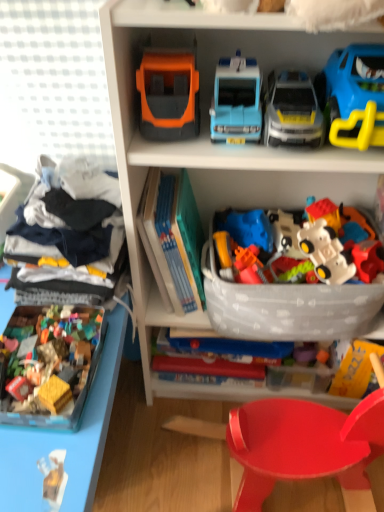
Where is `orange matte truck at upper center, placed as the second toy when sorted from left to right`? orange matte truck at upper center, placed as the second toy when sorted from left to right is located at coordinates (169, 95).

In order to face matte blue plastic car at center, which is counted as the 4th toy, starting from the left, should I rotate leftwards or rightwards?

Turn right approximately 12.968 degrees to face it.

The image size is (384, 512). What do you see at coordinates (292, 111) in the screenshot?
I see `matte blue plastic car at center, placed as the third toy when sorted from right to left` at bounding box center [292, 111].

The width and height of the screenshot is (384, 512). Describe the element at coordinates (297, 246) in the screenshot. I see `white plastic toy car at center, which ranks as the 5th toy in left-to-right order` at that location.

Identify the location of hardcover book at center. This screenshot has height=512, width=384. (175, 237).

What is the approximate height of hardcover book at center?

It is 11.91 inches.

Measure the distance between plastic toy blocks at lower left and camera.

plastic toy blocks at lower left and camera are 25.12 inches apart from each other.

The image size is (384, 512). What do you see at coordinates (65, 439) in the screenshot?
I see `plastic toy blocks at lower left` at bounding box center [65, 439].

Identify the location of blue plastic car at upper right, the first toy when ordered from right to left. (354, 95).

Describe the element at coordinates (354, 95) in the screenshot. I see `blue plastic car at upper right, arranged as the 6th toy when viewed from the left` at that location.

Image resolution: width=384 pixels, height=512 pixels. I want to click on orange matte truck at upper center, placed as the second toy when sorted from left to right, so click(x=169, y=95).

Which of these two, plastic toy blocks at lower left or white plastic toy car at center, the 2th toy viewed from the right, is thinner?

With smaller width is white plastic toy car at center, the 2th toy viewed from the right.

Which is more to the left, plastic toy blocks at lower left or white plastic toy car at center, the 2th toy viewed from the right?

plastic toy blocks at lower left.

The width and height of the screenshot is (384, 512). I want to click on the 2nd toy above the plastic toy blocks at lower left (from the image's perspective), so click(297, 246).

Looking at this image, would you say plastic toy blocks at lower left is outside white plastic toy car at center, the 2th toy viewed from the right?

Yes, plastic toy blocks at lower left is located beyond the bounds of white plastic toy car at center, the 2th toy viewed from the right.

Which of these two, plastic toy blocks at lower left or shiny plastic chair at lower center, is smaller?

Smaller between the two is shiny plastic chair at lower center.

Who is shorter, plastic toy blocks at lower left or shiny plastic chair at lower center?

shiny plastic chair at lower center.

Is shiny plastic chair at lower center located within plastic toy blocks at lower left?

No, shiny plastic chair at lower center is not surrounded by plastic toy blocks at lower left.

Between hardcover book at center and orange matte truck at upper center, the 5th toy in the right-to-left sequence, which one has smaller size?

orange matte truck at upper center, the 5th toy in the right-to-left sequence, is smaller.

From their relative heights in the image, would you say hardcover book at center is taller or shorter than orange matte truck at upper center, the 5th toy in the right-to-left sequence?

hardcover book at center is taller than orange matte truck at upper center, the 5th toy in the right-to-left sequence.

Is hardcover book at center positioned behind orange matte truck at upper center, the 5th toy in the right-to-left sequence?

Yes, the depth of hardcover book at center is greater than that of orange matte truck at upper center, the 5th toy in the right-to-left sequence.

Is hardcover book at center situated inside orange matte truck at upper center, the 5th toy in the right-to-left sequence, or outside?

hardcover book at center is not inside orange matte truck at upper center, the 5th toy in the right-to-left sequence, it's outside.

Is light blue plastic toy car at upper center, acting as the 3th toy starting from the left, facing away from plastic toy blocks at lower left?

No, light blue plastic toy car at upper center, acting as the 3th toy starting from the left,'s orientation is not away from plastic toy blocks at lower left.

Is light blue plastic toy car at upper center, which ranks as the 4th toy in right-to-left order, next to plastic toy blocks at lower left?

No, light blue plastic toy car at upper center, which ranks as the 4th toy in right-to-left order, is not beside plastic toy blocks at lower left.

From the picture: Could you measure the distance between light blue plastic toy car at upper center, acting as the 3th toy starting from the left, and plastic toy blocks at lower left?

21.24 inches.

Considering the sizes of light blue plastic toy car at upper center, acting as the 3th toy starting from the left, and plastic toy blocks at lower left in the image, is light blue plastic toy car at upper center, acting as the 3th toy starting from the left, bigger or smaller than plastic toy blocks at lower left?

In the image, light blue plastic toy car at upper center, acting as the 3th toy starting from the left, appears to be smaller than plastic toy blocks at lower left.

Is there a large distance between white cotton shirt at left and light blue plastic toy car at upper center, which ranks as the 4th toy in right-to-left order?

That's not correct — white cotton shirt at left is a little close to light blue plastic toy car at upper center, which ranks as the 4th toy in right-to-left order.

Is white cotton shirt at left taller or shorter than light blue plastic toy car at upper center, acting as the 3th toy starting from the left?

In the image, white cotton shirt at left appears to be taller than light blue plastic toy car at upper center, acting as the 3th toy starting from the left.

From the image's perspective, which is above, white cotton shirt at left or light blue plastic toy car at upper center, which ranks as the 4th toy in right-to-left order?

From the image's view, light blue plastic toy car at upper center, which ranks as the 4th toy in right-to-left order, is above.

From a real-world perspective, relative to light blue plastic toy car at upper center, which ranks as the 4th toy in right-to-left order, is white cotton shirt at left vertically above or below?

From a real-world perspective, white cotton shirt at left is physically below light blue plastic toy car at upper center, which ranks as the 4th toy in right-to-left order.

From the image's perspective, is orange matte truck at upper center, placed as the second toy when sorted from left to right, over multicolored plastic building blocks at lower left, the sixth toy in the right-to-left sequence?

Yes, from the image's perspective, orange matte truck at upper center, placed as the second toy when sorted from left to right, is over multicolored plastic building blocks at lower left, the sixth toy in the right-to-left sequence.

Between orange matte truck at upper center, the 5th toy in the right-to-left sequence, and multicolored plastic building blocks at lower left, arranged as the 1th toy when viewed from the left, which one is positioned in front?

multicolored plastic building blocks at lower left, arranged as the 1th toy when viewed from the left.

Considering the points (153, 90) and (59, 381), which point is behind, point (153, 90) or point (59, 381)?

Point (153, 90)

Considering the relative sizes of orange matte truck at upper center, the 5th toy in the right-to-left sequence, and multicolored plastic building blocks at lower left, the sixth toy in the right-to-left sequence, in the image provided, is orange matte truck at upper center, the 5th toy in the right-to-left sequence, smaller than multicolored plastic building blocks at lower left, the sixth toy in the right-to-left sequence,?

Yes, orange matte truck at upper center, the 5th toy in the right-to-left sequence, is smaller than multicolored plastic building blocks at lower left, the sixth toy in the right-to-left sequence.

Could you measure the distance between orange matte truck at upper center, placed as the second toy when sorted from left to right, and blue plastic car at upper right, arranged as the 6th toy when viewed from the left?

A distance of 11.08 inches exists between orange matte truck at upper center, placed as the second toy when sorted from left to right, and blue plastic car at upper right, arranged as the 6th toy when viewed from the left.

Considering the sizes of objects orange matte truck at upper center, placed as the second toy when sorted from left to right, and blue plastic car at upper right, arranged as the 6th toy when viewed from the left, in the image provided, who is bigger, orange matte truck at upper center, placed as the second toy when sorted from left to right, or blue plastic car at upper right, arranged as the 6th toy when viewed from the left,?

blue plastic car at upper right, arranged as the 6th toy when viewed from the left, is bigger.

Can you confirm if orange matte truck at upper center, the 5th toy in the right-to-left sequence, is wider than blue plastic car at upper right, the first toy when ordered from right to left?

No.

Where is `shelf in front of the white plastic toy car at center, which ranks as the 5th toy in left-to-right order`? The image size is (384, 512). shelf in front of the white plastic toy car at center, which ranks as the 5th toy in left-to-right order is located at coordinates (65, 439).

Find the location of a particular element. shelf that appears on the left of shiny plastic chair at lower center is located at coordinates (65, 439).

Based on their spatial positions, is matte blue plastic car at center, placed as the third toy when sorted from right to left, or plastic toy blocks at lower left further from shiny plastic chair at lower center?

The object further to shiny plastic chair at lower center is matte blue plastic car at center, placed as the third toy when sorted from right to left.

Looking at the image, which one is located closer to matte blue plastic car at center, which is counted as the 4th toy, starting from the left, white plastic toy car at center, the 2th toy viewed from the right, or orange matte truck at upper center, the 5th toy in the right-to-left sequence?

Among the two, orange matte truck at upper center, the 5th toy in the right-to-left sequence, is located nearer to matte blue plastic car at center, which is counted as the 4th toy, starting from the left.

Looking at the image, which one is located closer to light blue plastic toy car at upper center, which ranks as the 4th toy in right-to-left order, shiny plastic chair at lower center or blue plastic car at upper right, the first toy when ordered from right to left?

Based on the image, blue plastic car at upper right, the first toy when ordered from right to left, appears to be nearer to light blue plastic toy car at upper center, which ranks as the 4th toy in right-to-left order.

When comparing their distances from white cotton shirt at left, does blue plastic car at upper right, the first toy when ordered from right to left, or orange matte truck at upper center, the 5th toy in the right-to-left sequence, seem further?

Based on the image, blue plastic car at upper right, the first toy when ordered from right to left, appears to be further to white cotton shirt at left.

From the image, which object appears to be nearer to white plastic toy car at center, which ranks as the 5th toy in left-to-right order, plastic toy blocks at lower left or orange matte truck at upper center, the 5th toy in the right-to-left sequence?

The object closer to white plastic toy car at center, which ranks as the 5th toy in left-to-right order, is orange matte truck at upper center, the 5th toy in the right-to-left sequence.

Considering their positions, is multicolored plastic building blocks at lower left, the sixth toy in the right-to-left sequence, positioned closer to white plastic toy car at center, which ranks as the 5th toy in left-to-right order, than light blue plastic toy car at upper center, which ranks as the 4th toy in right-to-left order?

light blue plastic toy car at upper center, which ranks as the 4th toy in right-to-left order.

Estimate the real-world distances between objects in this image. Which object is further from white cotton shirt at left, shiny plastic chair at lower center or light blue plastic toy car at upper center, which ranks as the 4th toy in right-to-left order?

shiny plastic chair at lower center is further to white cotton shirt at left.

Based on their spatial positions, is blue plastic car at upper right, the first toy when ordered from right to left, or light blue plastic toy car at upper center, acting as the 3th toy starting from the left, further from white plastic toy car at center, which ranks as the 5th toy in left-to-right order?

light blue plastic toy car at upper center, acting as the 3th toy starting from the left.

Where is `bookcase between light blue plastic toy car at upper center, acting as the 3th toy starting from the left, and shiny plastic chair at lower center in the up-down direction`? bookcase between light blue plastic toy car at upper center, acting as the 3th toy starting from the left, and shiny plastic chair at lower center in the up-down direction is located at coordinates (217, 144).

The width and height of the screenshot is (384, 512). I want to click on bookcase between hardcover book at center and shiny plastic chair at lower center vertically, so click(217, 144).

At what (x,y) coordinates should I click in order to perform the action: click on book between blue plastic car at upper right, the first toy when ordered from right to left, and shiny plastic chair at lower center in the up-down direction. Please return your answer as a coordinate pair (x, y). The width and height of the screenshot is (384, 512). Looking at the image, I should click on (175, 237).

In order to click on bookcase between plastic toy blocks at lower left and blue plastic car at upper right, arranged as the 6th toy when viewed from the left, from left to right in this screenshot , I will do `click(217, 144)`.